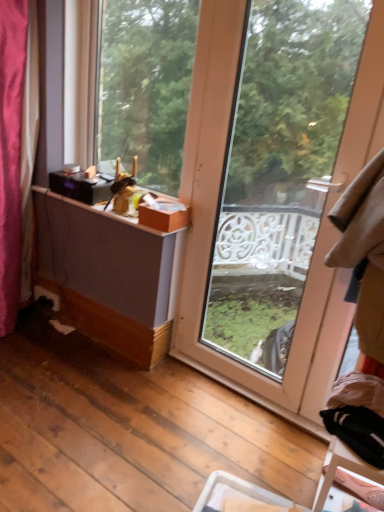
Question: Is matte wood window at center, which ranks as the second window in right-to-left order, next to transparent glass door at center, placed as the second window when sorted from left to right?

Choices:
 (A) yes
 (B) no

Answer: (B)

Question: Could you tell me if matte wood window at center, which ranks as the 1th window in left-to-right order, is turned towards transparent glass door at center, placed as the second window when sorted from left to right?

Choices:
 (A) no
 (B) yes

Answer: (A)

Question: Does matte wood window at center, which ranks as the 1th window in left-to-right order, come in front of transparent glass door at center, placed as the second window when sorted from left to right?

Choices:
 (A) no
 (B) yes

Answer: (A)

Question: Considering the relative sizes of matte wood window at center, which ranks as the 1th window in left-to-right order, and transparent glass door at center, placed as the second window when sorted from left to right, in the image provided, is matte wood window at center, which ranks as the 1th window in left-to-right order, thinner than transparent glass door at center, placed as the second window when sorted from left to right,?

Choices:
 (A) no
 (B) yes

Answer: (A)

Question: From the image's perspective, is matte wood window at center, which ranks as the second window in right-to-left order, located above transparent glass door at center, placed as the second window when sorted from left to right?

Choices:
 (A) yes
 (B) no

Answer: (A)

Question: Is matte wood window at center, which ranks as the 1th window in left-to-right order, bigger or smaller than orange cardboard box at upper center?

Choices:
 (A) small
 (B) big

Answer: (B)

Question: In terms of width, does matte wood window at center, which ranks as the second window in right-to-left order, look wider or thinner when compared to orange cardboard box at upper center?

Choices:
 (A) wide
 (B) thin

Answer: (B)

Question: Relative to orange cardboard box at upper center, is matte wood window at center, which ranks as the second window in right-to-left order, in front or behind?

Choices:
 (A) behind
 (B) front

Answer: (B)

Question: From a real-world perspective, is matte wood window at center, which ranks as the 1th window in left-to-right order, above or below orange cardboard box at upper center?

Choices:
 (A) below
 (B) above

Answer: (B)

Question: Considering the positions of orange cardboard box at upper center and transparent glass door at center, the first window positioned from the right, in the image, is orange cardboard box at upper center wider or thinner than transparent glass door at center, the first window positioned from the right,?

Choices:
 (A) thin
 (B) wide

Answer: (B)

Question: From the image's perspective, is orange cardboard box at upper center located above or below transparent glass door at center, placed as the second window when sorted from left to right?

Choices:
 (A) above
 (B) below

Answer: (A)

Question: In terms of height, does orange cardboard box at upper center look taller or shorter compared to transparent glass door at center, placed as the second window when sorted from left to right?

Choices:
 (A) tall
 (B) short

Answer: (B)

Question: Relative to transparent glass door at center, the first window positioned from the right, is orange cardboard box at upper center in front or behind?

Choices:
 (A) front
 (B) behind

Answer: (B)

Question: Considering the positions of transparent glass door at center, the first window positioned from the right, and matte wood window at center, which ranks as the 1th window in left-to-right order, in the image, is transparent glass door at center, the first window positioned from the right, bigger or smaller than matte wood window at center, which ranks as the 1th window in left-to-right order,?

Choices:
 (A) big
 (B) small

Answer: (A)

Question: Considering the positions of transparent glass door at center, the first window positioned from the right, and matte wood window at center, which ranks as the 1th window in left-to-right order, in the image, is transparent glass door at center, the first window positioned from the right, wider or thinner than matte wood window at center, which ranks as the 1th window in left-to-right order,?

Choices:
 (A) thin
 (B) wide

Answer: (A)